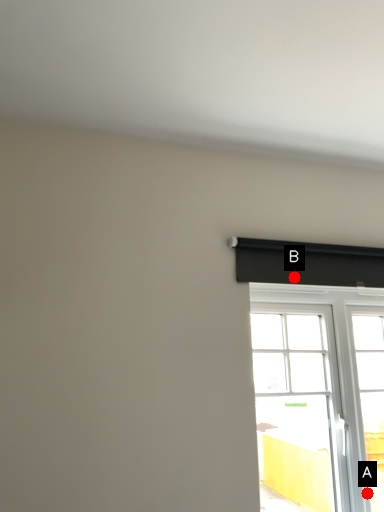
Question: Two points are circled on the image, labeled by A and B beside each circle. Which of the following is the farthest from the observer?

Choices:
 (A) A is further
 (B) B is further

Answer: (A)